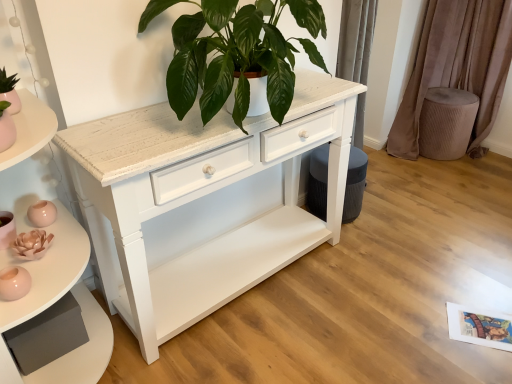
Question: From the image's perspective, is velvet taupe stool at right under white wood chest of drawers at center?

Choices:
 (A) no
 (B) yes

Answer: (A)

Question: Considering the relative sizes of velvet taupe stool at right and white wood chest of drawers at center in the image provided, is velvet taupe stool at right thinner than white wood chest of drawers at center?

Choices:
 (A) yes
 (B) no

Answer: (A)

Question: Is velvet taupe stool at right positioned far away from white wood chest of drawers at center?

Choices:
 (A) no
 (B) yes

Answer: (B)

Question: Is velvet taupe stool at right in front of white wood chest of drawers at center?

Choices:
 (A) no
 (B) yes

Answer: (A)

Question: Considering the relative positions of velvet taupe stool at right and white wood chest of drawers at center in the image provided, is velvet taupe stool at right to the right of white wood chest of drawers at center from the viewer's perspective?

Choices:
 (A) no
 (B) yes

Answer: (B)

Question: Does velvet taupe stool at right appear on the left side of white wood chest of drawers at center?

Choices:
 (A) yes
 (B) no

Answer: (B)

Question: Is white painted wood shelf at left wider than white wood chest of drawers at center?

Choices:
 (A) yes
 (B) no

Answer: (B)

Question: Does white painted wood shelf at left have a smaller size compared to white wood chest of drawers at center?

Choices:
 (A) no
 (B) yes

Answer: (A)

Question: Is white painted wood shelf at left thinner than white wood chest of drawers at center?

Choices:
 (A) no
 (B) yes

Answer: (B)

Question: From a real-world perspective, is white painted wood shelf at left located higher than white wood chest of drawers at center?

Choices:
 (A) no
 (B) yes

Answer: (B)

Question: From a real-world perspective, does white painted wood shelf at left sit lower than white wood chest of drawers at center?

Choices:
 (A) yes
 (B) no

Answer: (B)

Question: Is white painted wood shelf at left positioned far away from white wood chest of drawers at center?

Choices:
 (A) no
 (B) yes

Answer: (A)

Question: Is velvet taupe curtain at right thinner than white wood chest of drawers at center?

Choices:
 (A) no
 (B) yes

Answer: (B)